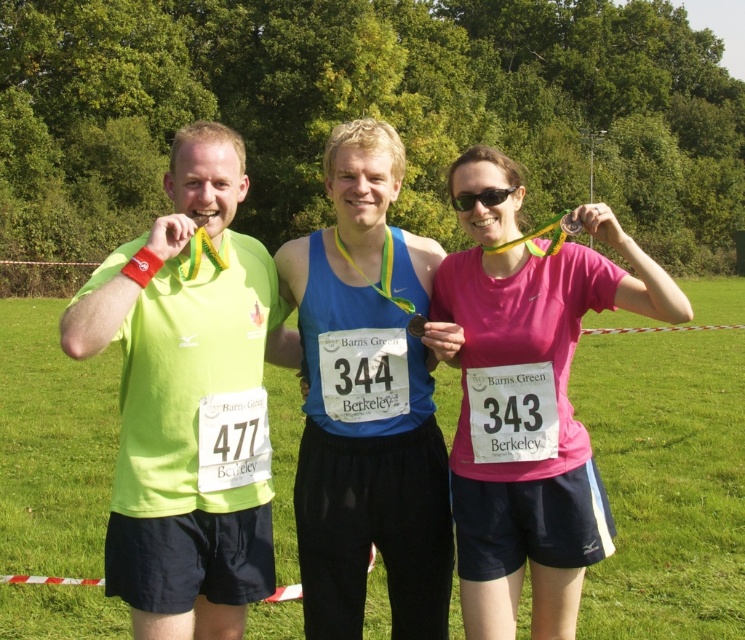
Question: Is matte green shirt at left smaller than blue fabric tank top at center?

Choices:
 (A) no
 (B) yes

Answer: (B)

Question: Which of the following is the closest to the observer?

Choices:
 (A) (475, 541)
 (B) (139, 365)

Answer: (B)

Question: Which of these objects is positioned closest to the blue fabric tank top at center?

Choices:
 (A) pink matte shirt at center
 (B) matte green shirt at left

Answer: (A)

Question: Can you confirm if matte green shirt at left is positioned to the right of blue fabric tank top at center?

Choices:
 (A) no
 (B) yes

Answer: (A)

Question: Which object appears closest to the camera in this image?

Choices:
 (A) blue fabric tank top at center
 (B) pink matte shirt at center

Answer: (B)

Question: Is matte green shirt at left wider than pink matte shirt at center?

Choices:
 (A) yes
 (B) no

Answer: (A)